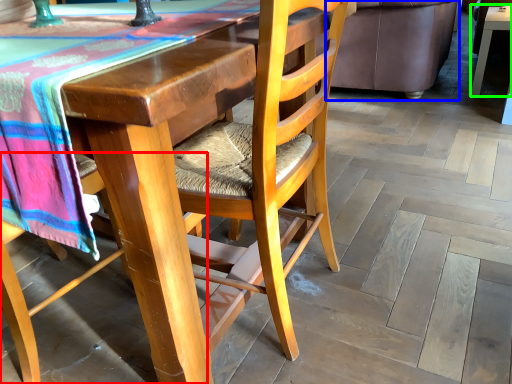
Question: Which object is positioned closest to chair (highlighted by a red box)? Select from couch (highlighted by a blue box) and table (highlighted by a green box).

Choices:
 (A) couch
 (B) table

Answer: (A)